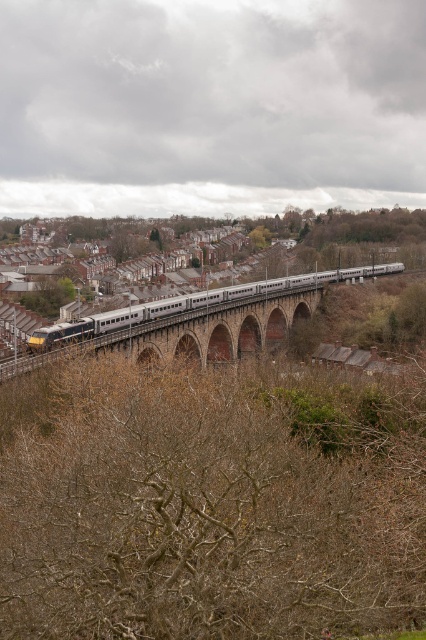
Question: Does brown stone arch bridge at center appear on the right side of silver metallic train at center?

Choices:
 (A) no
 (B) yes

Answer: (A)

Question: Which object is the farthest from the silver metallic train at center?

Choices:
 (A) brown stone arch bridge at center
 (B) green leafy tree at lower left

Answer: (B)

Question: Considering the real-world distances, which object is farthest from the brown stone arch bridge at center?

Choices:
 (A) silver metallic train at center
 (B) green leafy tree at lower left

Answer: (B)

Question: Considering the relative positions of silver metallic train at center and green leafy tree at lower left in the image provided, where is silver metallic train at center located with respect to green leafy tree at lower left?

Choices:
 (A) below
 (B) above

Answer: (A)

Question: From the image, what is the correct spatial relationship of brown stone arch bridge at center in relation to silver metallic train at center?

Choices:
 (A) above
 (B) below

Answer: (B)

Question: Among these points, which one is nearest to the camera?

Choices:
 (A) (201, 333)
 (B) (379, 268)
 (C) (65, 300)

Answer: (A)